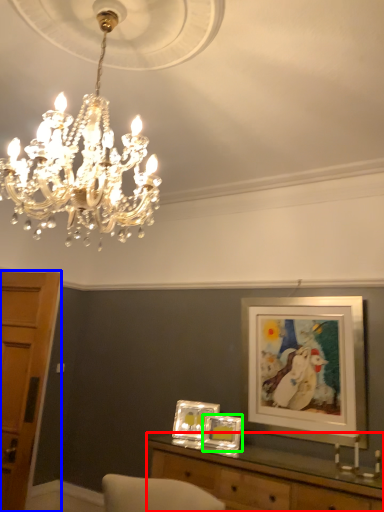
Question: Which object is positioned closest to table (highlighted by a red box)? Select from cabinetry (highlighted by a blue box) and picture frame (highlighted by a green box).

Choices:
 (A) cabinetry
 (B) picture frame

Answer: (B)